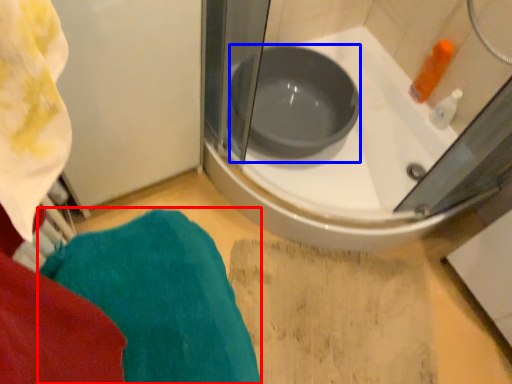
Question: Which point is further to the camera, bath towel (highlighted by a red box) or basin (highlighted by a blue box)?

Choices:
 (A) bath towel
 (B) basin

Answer: (B)